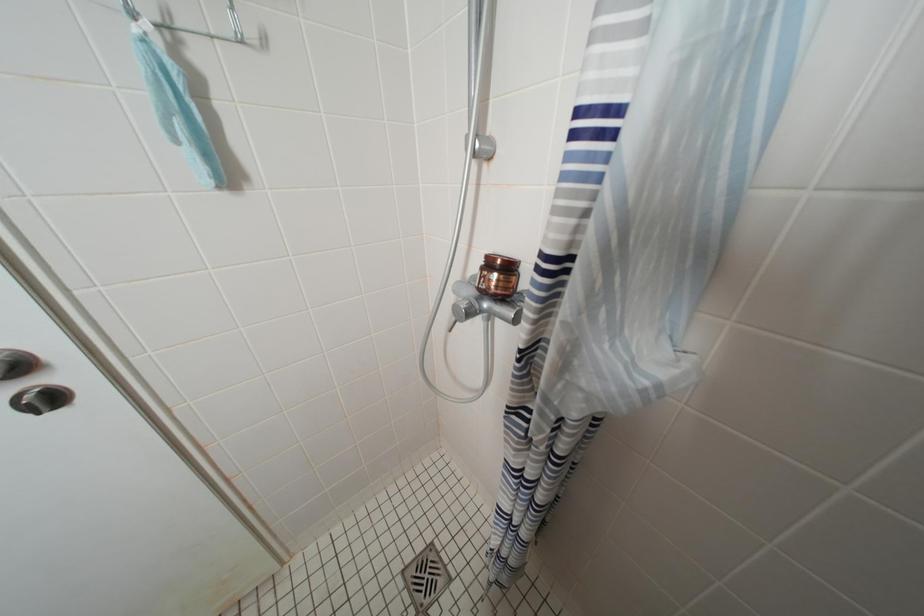
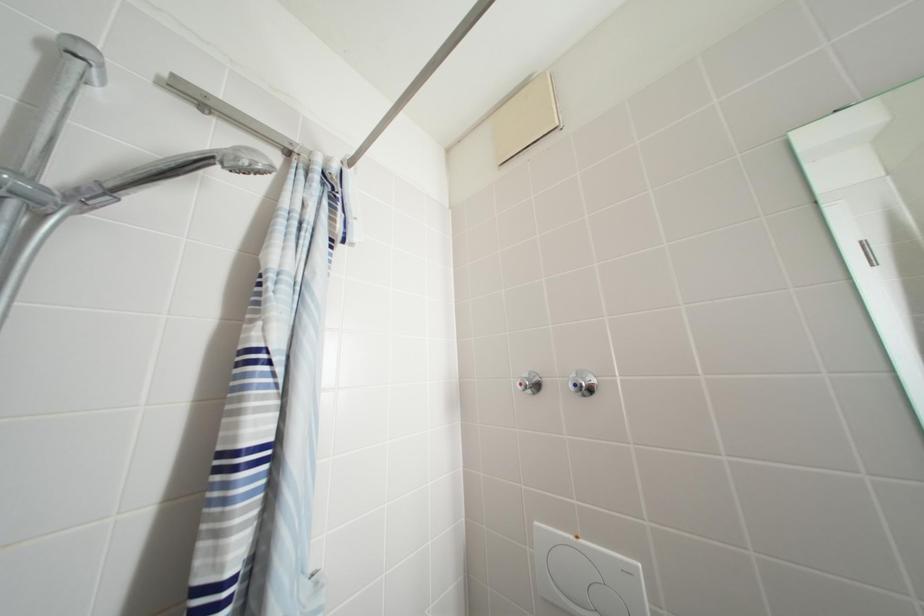
Question: How did the camera likely rotate?

Choices:
 (A) Left
 (B) Right
 (C) Up
 (D) Down

Answer: (B)